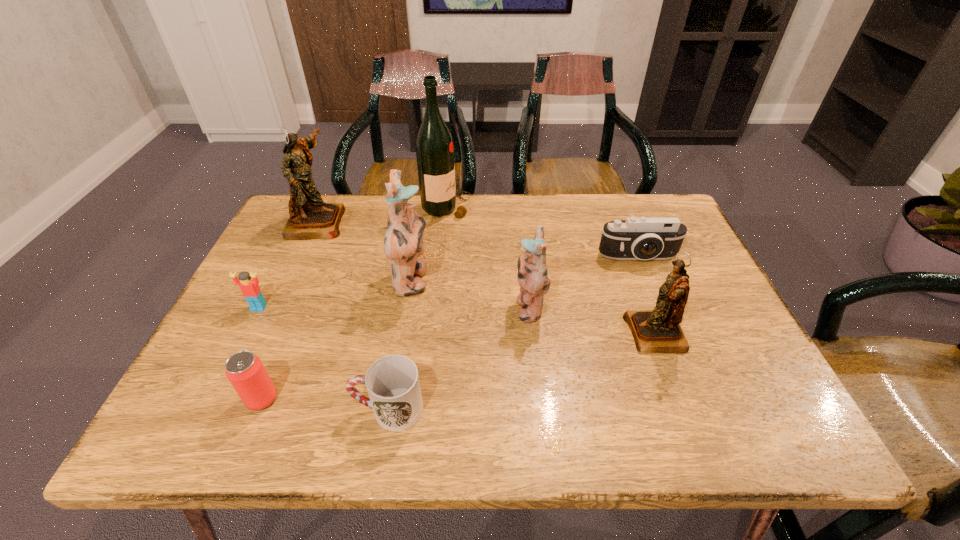
At what (x,y) coordinates should I click in order to perform the action: click on blank space at the far edge of the desktop. Please return your answer as a coordinate pair (x, y). The width and height of the screenshot is (960, 540). Looking at the image, I should click on (537, 218).

In the image, there is a desktop. At what (x,y) coordinates should I click in order to perform the action: click on vacant space at the near edge. Please return your answer as a coordinate pair (x, y). This screenshot has width=960, height=540. Looking at the image, I should click on (522, 445).

At what (x,y) coordinates should I click in order to perform the action: click on free space at the left edge. Please return your answer as a coordinate pair (x, y). The width and height of the screenshot is (960, 540). Looking at the image, I should click on (263, 252).

In the image, there is a desktop. At what (x,y) coordinates should I click in order to perform the action: click on vacant space at the right edge. Please return your answer as a coordinate pair (x, y). This screenshot has height=540, width=960. Looking at the image, I should click on (705, 373).

Find the location of a particular element. The image size is (960, 540). vacant space at the far right corner of the desktop is located at coordinates (641, 210).

Identify the location of unoccupied position between the beer can and the red cup. (325, 404).

Find the location of a particular element. The height and width of the screenshot is (540, 960). free spot between the farther gold figurine and the camera is located at coordinates (478, 240).

Find the location of a particular element. empty space that is in between the tallest object and the bigger pink figurine is located at coordinates (429, 245).

This screenshot has width=960, height=540. Identify the location of free spot between the camera and the smaller pink figurine. (584, 282).

This screenshot has height=540, width=960. Identify the location of free spot between the leftmost figurine and the red cup. (352, 315).